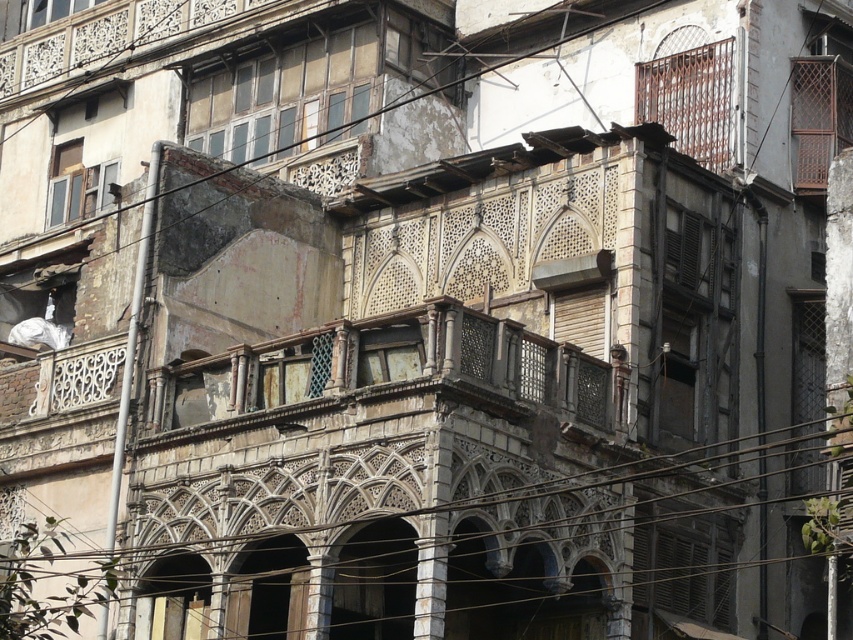
You are a maintenance worker assessing the building. You notice the metallic wire at upper center and the rusty metal balcony at center. Which object requires immediate attention based on their size differences?

The metallic wire at upper center requires immediate attention because it has a larger size compared to the rusty metal balcony at center, which may indicate structural instability or safety risks.

Consider the image. You are an architect assessing the structural integrity of the building. You notice the metallic wire at upper center and the rusty metal balcony at center. Which of these two elements has a greater width?

The metallic wire at upper center has a greater width than the rusty metal balcony at center according to the description.